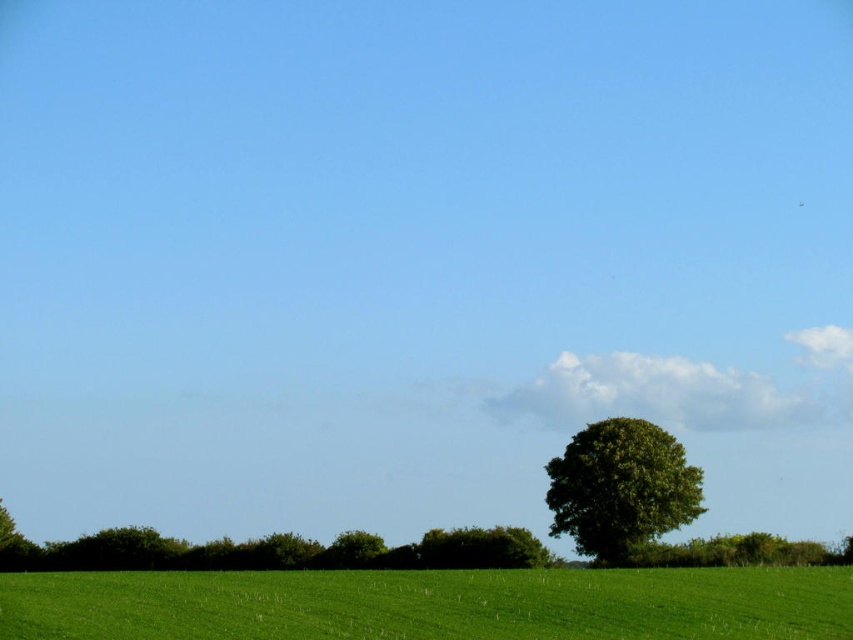
Question: Can you confirm if green grassy field at lower center is positioned to the left of green leafy tree at center?

Choices:
 (A) no
 (B) yes

Answer: (B)

Question: Which point is farther to the camera?

Choices:
 (A) green leafy tree at center
 (B) green grassy field at lower center

Answer: (A)

Question: Is green grassy field at lower center behind green leafy tree at center?

Choices:
 (A) yes
 (B) no

Answer: (B)

Question: Which point appears closest to the camera in this image?

Choices:
 (A) (699, 506)
 (B) (651, 620)

Answer: (B)

Question: Which object is farther from the camera taking this photo?

Choices:
 (A) green grassy field at lower center
 (B) green leafy tree at center

Answer: (B)

Question: Can you confirm if green grassy field at lower center is positioned to the right of green leafy tree at center?

Choices:
 (A) no
 (B) yes

Answer: (A)